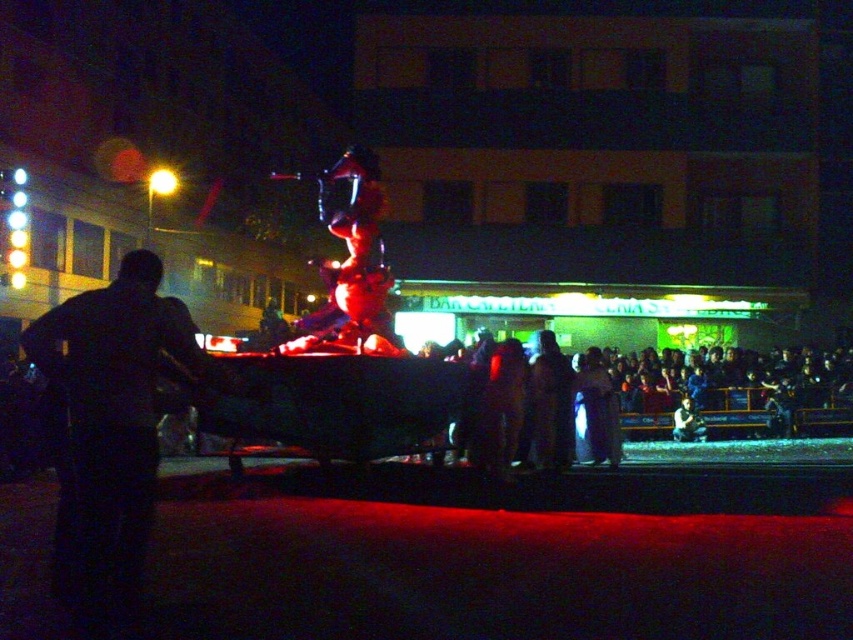
Question: Which point is farther from the camera taking this photo?

Choices:
 (A) (703, 433)
 (B) (142, 472)
 (C) (561, 435)

Answer: (A)

Question: Is black matte jacket at left to the left of dark clothing crowd at right from the viewer's perspective?

Choices:
 (A) yes
 (B) no

Answer: (A)

Question: Does dark clothing crowd at right have a lesser width compared to dark fabric dress at center?

Choices:
 (A) no
 (B) yes

Answer: (A)

Question: Among these points, which one is farthest from the camera?

Choices:
 (A) (549, 420)
 (B) (691, 422)
 (C) (171, 323)
 (D) (538, 408)

Answer: (B)

Question: Does dark clothing crowd at right appear on the right side of smooth skin face at center?

Choices:
 (A) yes
 (B) no

Answer: (B)

Question: Which object is farther from the camera taking this photo?

Choices:
 (A) dark fabric dress at center
 (B) smooth skin face at center
 (C) dark clothing crowd at right
 (D) black matte jacket at left

Answer: (B)